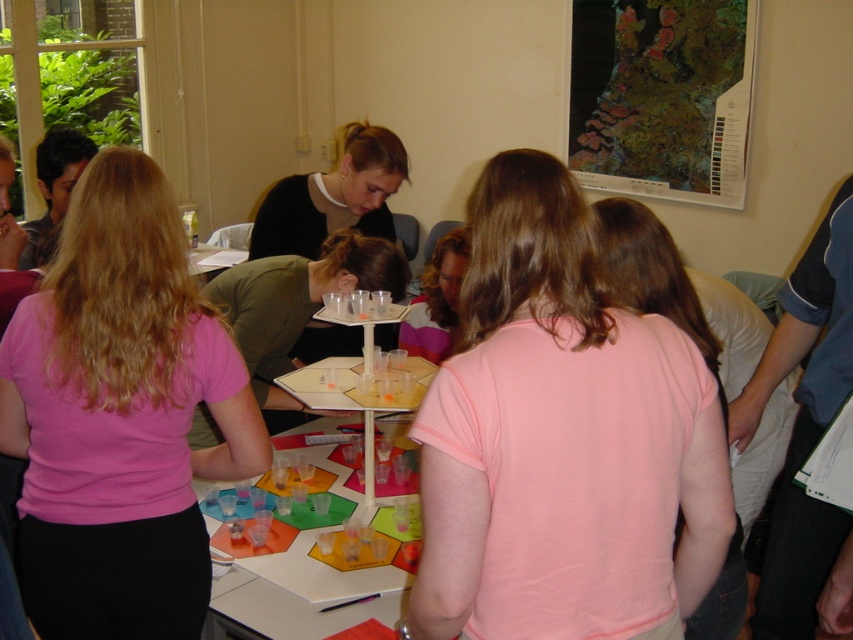
Question: Which point appears farthest from the camera in this image?

Choices:
 (A) (283, 392)
 (B) (426, 314)

Answer: (B)

Question: Can you confirm if green matte shirt at center is bigger than translucent plastic cups at center?

Choices:
 (A) no
 (B) yes

Answer: (B)

Question: Which object is farther from the camera taking this photo?

Choices:
 (A) translucent plastic hexagon at center
 (B) pink matte shirt at center

Answer: (A)

Question: Based on their relative distances, which object is nearer to the translucent plastic cups at center?

Choices:
 (A) matte black shirt at center
 (B) green matte shirt at center
 (C) pink matte shirt at center

Answer: (B)

Question: Is translucent plastic cups at center bigger than translucent plastic hexagon at center?

Choices:
 (A) yes
 (B) no

Answer: (A)

Question: Can you confirm if pink matte shirt at center is positioned to the left of translucent plastic hexagon at center?

Choices:
 (A) yes
 (B) no

Answer: (A)